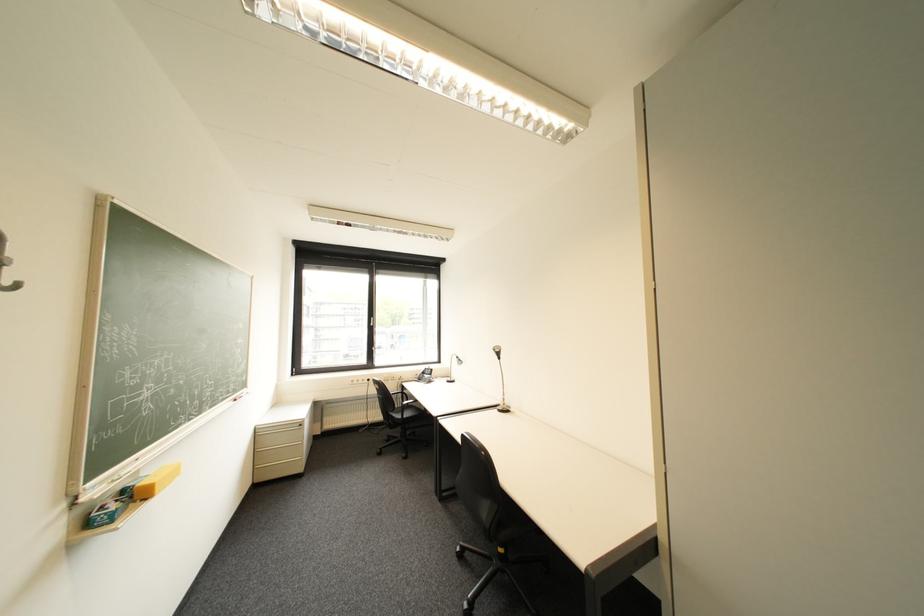
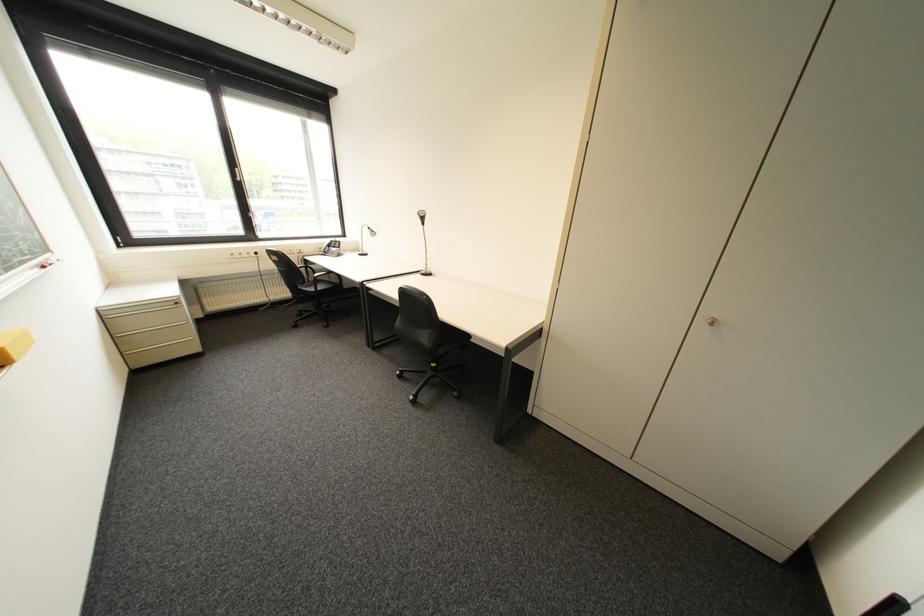
Locate, in the second image, the point that corresponds to the point at 270,435 in the first image.

(119, 318)